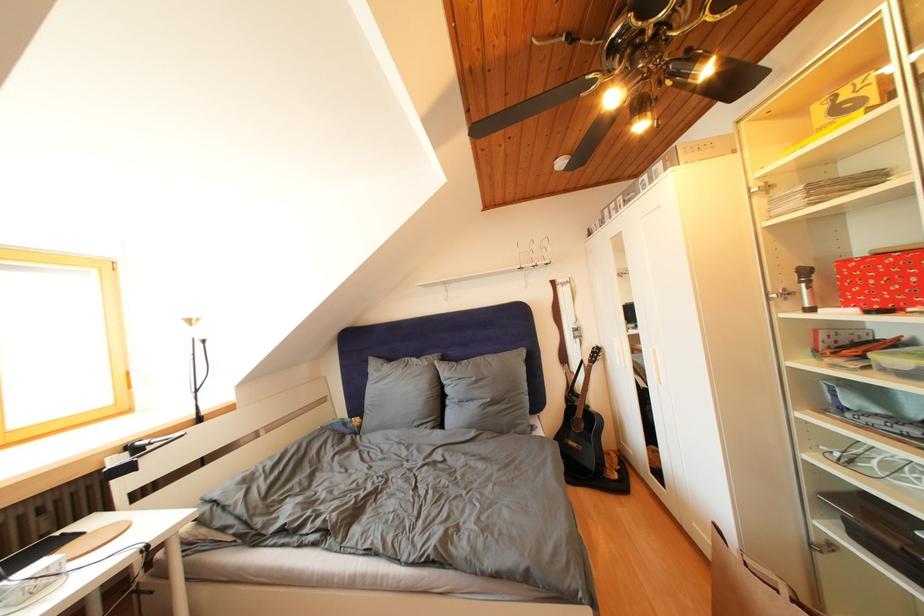
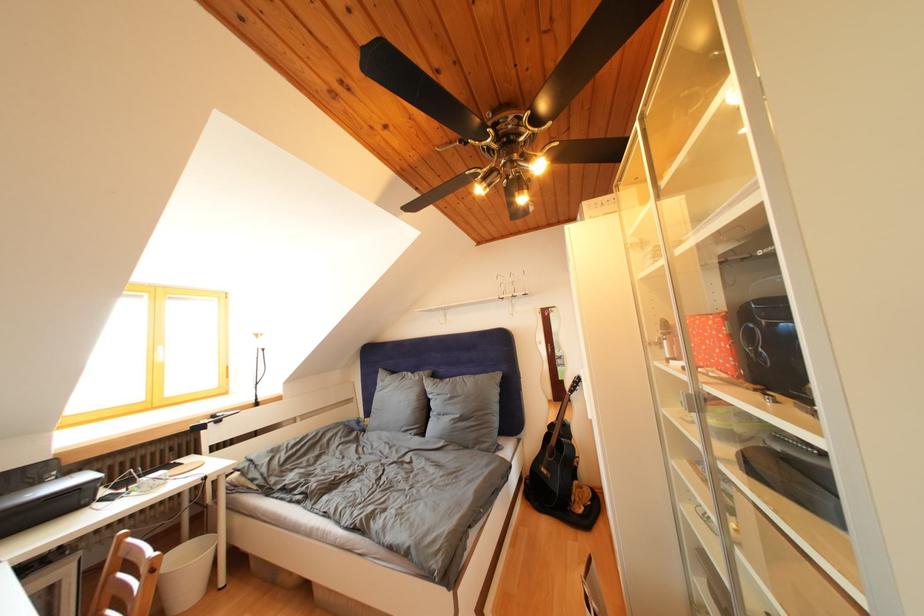
Locate, in the second image, the point that corresponds to the point at 433,369 in the first image.

(426, 383)